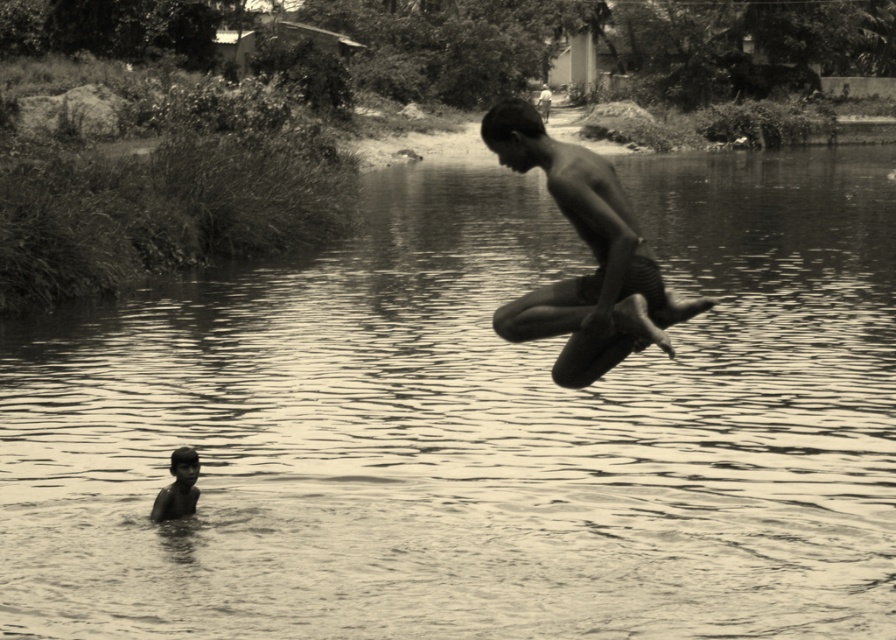
Question: Can you confirm if smooth skin man at center is positioned to the right of smooth skin child at lower left?

Choices:
 (A) yes
 (B) no

Answer: (A)

Question: Which point is farther to the camera?

Choices:
 (A) smooth skin child at lower left
 (B) smooth skin man at center

Answer: (A)

Question: Which point is farther to the camera?

Choices:
 (A) (175, 512)
 (B) (650, 298)

Answer: (A)

Question: Can you confirm if smooth skin man at center is positioned to the left of smooth skin child at lower left?

Choices:
 (A) yes
 (B) no

Answer: (B)

Question: Is smooth skin man at center above smooth skin child at lower left?

Choices:
 (A) yes
 (B) no

Answer: (A)